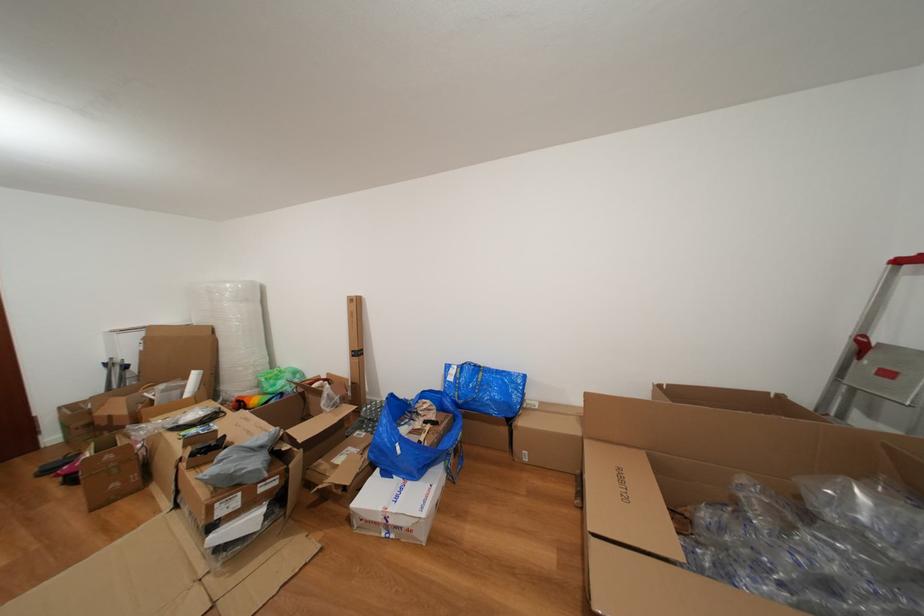
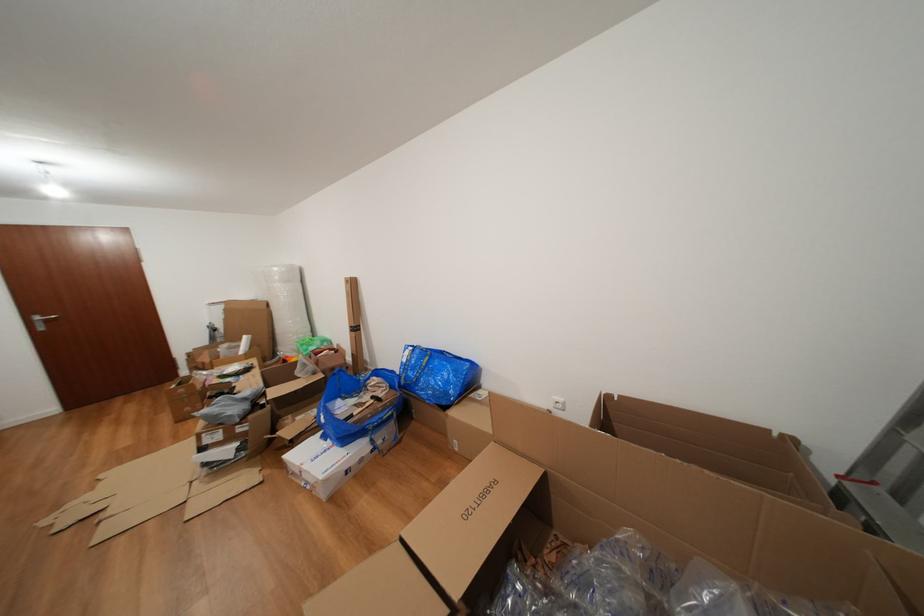
Question: What movement of the cameraman would produce the second image?

Choices:
 (A) Left
 (B) Right
 (C) Forward
 (D) Backward

Answer: (B)